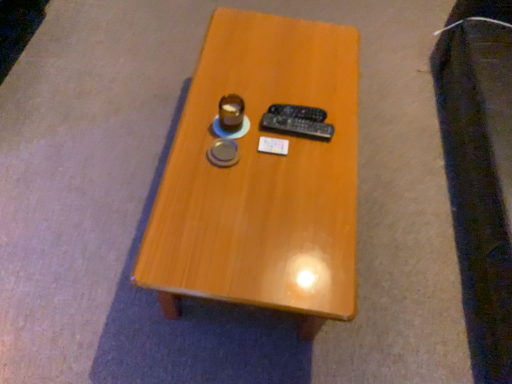
Where is `blank space to the left of black plastic remote control at center, arranged as the 1th remote control when viewed from the back`? The width and height of the screenshot is (512, 384). blank space to the left of black plastic remote control at center, arranged as the 1th remote control when viewed from the back is located at coordinates (238, 97).